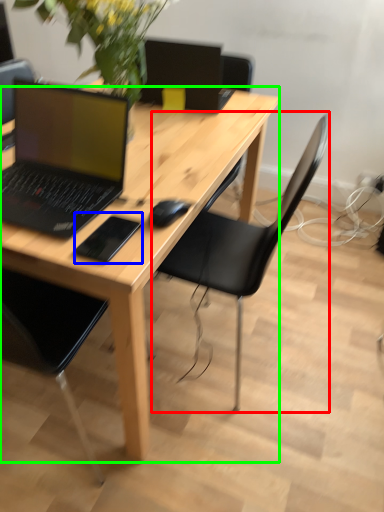
Question: Estimate the real-world distances between objects in this image. Which object is closer to chair (highlighted by a red box), mousepad (highlighted by a blue box) or desk (highlighted by a green box)?

Choices:
 (A) mousepad
 (B) desk

Answer: (B)